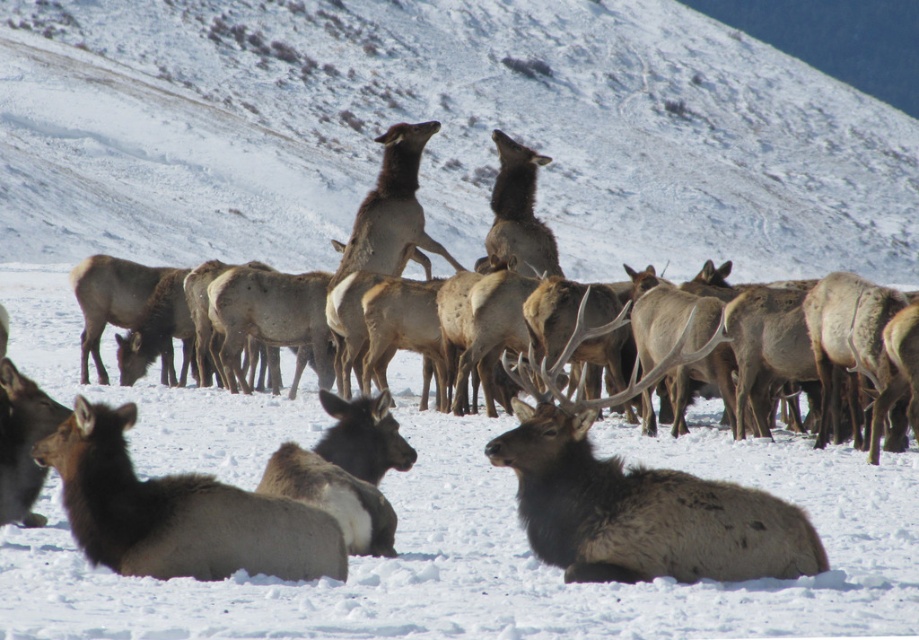
From the picture: Is snowy white hillside at upper center bigger than brown velvet antlers at upper center?

Yes, snowy white hillside at upper center is bigger than brown velvet antlers at upper center.

Measure the distance between snowy white hillside at upper center and brown velvet antlers at upper center.

snowy white hillside at upper center is 15.21 meters from brown velvet antlers at upper center.

Find the location of a particular element. The image size is (919, 640). snowy white hillside at upper center is located at coordinates (439, 132).

This screenshot has height=640, width=919. I want to click on snowy white hillside at upper center, so click(x=439, y=132).

Is brown velvet antlers at upper center smaller than brown matte/deer at center?

No, brown velvet antlers at upper center is not smaller than brown matte/deer at center.

Does brown velvet antlers at upper center come in front of brown matte/deer at center?

Yes.

Is point (435, 436) closer to camera compared to point (675, 499)?

No, it is behind (675, 499).

At what (x,y) coordinates should I click in order to perform the action: click on brown velvet antlers at upper center. Please return your answer as a coordinate pair (x, y). Looking at the image, I should click on (151, 392).

Is snowy white hillside at upper center below brown matte/deer at center?

No, snowy white hillside at upper center is not below brown matte/deer at center.

Who is higher up, snowy white hillside at upper center or brown matte/deer at center?

Positioned higher is snowy white hillside at upper center.

Is point (479, 208) closer to camera compared to point (598, 509)?

No, it is not.

This screenshot has height=640, width=919. I want to click on snowy white hillside at upper center, so click(x=439, y=132).